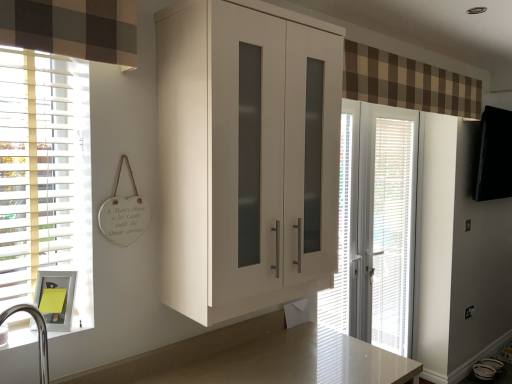
The height and width of the screenshot is (384, 512). Describe the element at coordinates (341, 236) in the screenshot. I see `white textured blind at center, which is the 2th blind from right to left` at that location.

I want to click on white textured blind at center, which is the second blind in back-to-front order, so click(x=341, y=236).

Describe the element at coordinates (56, 298) in the screenshot. I see `white glossy medicine cabinet at lower left` at that location.

What is the approximate height of white glossy medicine cabinet at lower left?

19.23 centimeters.

At what (x,y) coordinates should I click in order to perform the action: click on white glossy cabinet at center. Please return your answer as a coordinate pair (x, y). The height and width of the screenshot is (384, 512). Looking at the image, I should click on (246, 155).

What do you see at coordinates (393, 231) in the screenshot? This screenshot has width=512, height=384. I see `white plastic blinds at right, which appears as the second blind when viewed from the front` at bounding box center [393, 231].

Describe the element at coordinates (375, 227) in the screenshot. I see `white glossy door at center` at that location.

Locate an element on the screen. Image resolution: width=512 pixels, height=384 pixels. brushed metal sink at lower left is located at coordinates (48, 310).

Which object is closer to the camera taking this photo, brushed metal sink at lower left or white glossy medicine cabinet at lower left?

brushed metal sink at lower left.

Does brushed metal sink at lower left have a lesser width compared to white glossy medicine cabinet at lower left?

No, brushed metal sink at lower left is not thinner than white glossy medicine cabinet at lower left.

Based on their positions, is brushed metal sink at lower left located to the left or right of white glossy medicine cabinet at lower left?

Based on their positions, brushed metal sink at lower left is located to the right of white glossy medicine cabinet at lower left.

From the image's perspective, which is below, brushed metal sink at lower left or white glossy medicine cabinet at lower left?

brushed metal sink at lower left.

Consider the image. From the image's perspective, is brown checkered fabric at upper center on white glossy door at center?

Yes.

Considering the sizes of objects brown checkered fabric at upper center and white glossy door at center in the image provided, who is bigger, brown checkered fabric at upper center or white glossy door at center?

brown checkered fabric at upper center.

Can you tell me how much brown checkered fabric at upper center and white glossy door at center differ in facing direction?

They differ by 0.517 degrees in their facing directions.

Based on the photo, who is bigger, brushed metal sink at lower left or white textured blind at center, which is the 2th blind from right to left?

With larger size is white textured blind at center, which is the 2th blind from right to left.

From a real-world perspective, is brushed metal sink at lower left on white textured blind at center, which is the second blind in back-to-front order?

Incorrect, from a real-world perspective, brushed metal sink at lower left is lower than white textured blind at center, which is the second blind in back-to-front order.

Identify the location of the 1st blind behind the brushed metal sink at lower left. This screenshot has height=384, width=512. (341, 236).

Is brushed metal sink at lower left turned away from white textured blind at center, which is the first blind from front to back?

No, brushed metal sink at lower left is not facing away from white textured blind at center, which is the first blind from front to back.

Would you consider white plastic blinds at right, which appears as the second blind when viewed from the front, to be distant from brown checkered fabric at upper center?

No, white plastic blinds at right, which appears as the second blind when viewed from the front, is not far from brown checkered fabric at upper center.

From the image's perspective, who appears lower, white plastic blinds at right, which is the second blind from left to right, or brown checkered fabric at upper center?

white plastic blinds at right, which is the second blind from left to right, is shown below in the image.

Is white plastic blinds at right, acting as the first blind starting from the right, further to camera compared to brown checkered fabric at upper center?

Yes, it is behind brown checkered fabric at upper center.

Which is in front, point (380, 262) or point (385, 75)?

The point (385, 75) is more forward.

At what (x,y) coordinates should I click in order to perform the action: click on medicine cabinet in front of the brown checkered fabric at upper center. Please return your answer as a coordinate pair (x, y). The height and width of the screenshot is (384, 512). Looking at the image, I should click on (56, 298).

Looking at this image, is brown checkered fabric at upper center at the right side of white glossy medicine cabinet at lower left?

Indeed, brown checkered fabric at upper center is positioned on the right side of white glossy medicine cabinet at lower left.

Is brown checkered fabric at upper center looking in the opposite direction of white glossy medicine cabinet at lower left?

No.

Does point (351, 51) come behind point (49, 290)?

That is True.

Locate an element on the screen. medicine cabinet below the white glossy cabinet at center (from the image's perspective) is located at coordinates (56, 298).

Looking at this image, from a real-world perspective, relative to white glossy medicine cabinet at lower left, is white glossy cabinet at center vertically above or below?

white glossy cabinet at center is above white glossy medicine cabinet at lower left.

Between point (330, 191) and point (58, 314), which one is positioned behind?

The point (330, 191) is farther.

Considering the relative positions of white glossy cabinet at center and white glossy medicine cabinet at lower left in the image provided, is white glossy cabinet at center to the left of white glossy medicine cabinet at lower left from the viewer's perspective?

Incorrect, white glossy cabinet at center is not on the left side of white glossy medicine cabinet at lower left.

Measure the distance between brushed metal sink at lower left and white glossy door at center.

brushed metal sink at lower left is 1.96 meters away from white glossy door at center.

In the image, is brushed metal sink at lower left on the left side or the right side of white glossy door at center?

From the image, it's evident that brushed metal sink at lower left is to the left of white glossy door at center.

Does brushed metal sink at lower left have a greater height compared to white glossy door at center?

No, brushed metal sink at lower left is not taller than white glossy door at center.

From the image's perspective, is brushed metal sink at lower left located above or below white glossy door at center?

From the image's perspective, brushed metal sink at lower left appears below white glossy door at center.

I want to click on sink that is on the right side of white glossy medicine cabinet at lower left, so click(x=48, y=310).

What are the coordinates of `curtain above the white glossy door at center (from a real-world perspective)` in the screenshot? It's located at (407, 83).

From the picture: Which object lies nearer to the anchor point white glossy door at center, white glossy medicine cabinet at lower left or white glossy cabinet at center?

white glossy cabinet at center lies closer to white glossy door at center than the other object.

Considering their positions, is white textured blind at center, which is the second blind in back-to-front order, positioned further to brushed metal sink at lower left than white plastic blinds at right, acting as the first blind starting from the right?

Among the two, white plastic blinds at right, acting as the first blind starting from the right, is located further to brushed metal sink at lower left.

In the scene shown: From the image, which object appears to be nearer to brushed metal sink at lower left, brown checkered fabric at upper center or white glossy medicine cabinet at lower left?

The object closer to brushed metal sink at lower left is white glossy medicine cabinet at lower left.

When comparing their distances from white glossy door at center, does white plastic blinds at right, which appears as the second blind when viewed from the front, or white glossy cabinet at center seem further?

Based on the image, white glossy cabinet at center appears to be further to white glossy door at center.

Based on their spatial positions, is brown checkered fabric at upper center or white glossy door at center closer to white glossy cabinet at center?

Based on the image, brown checkered fabric at upper center appears to be nearer to white glossy cabinet at center.

When comparing their distances from white plastic blinds at right, which is the second blind from left to right, does white glossy door at center or white glossy cabinet at center seem further?

white glossy cabinet at center is further to white plastic blinds at right, which is the second blind from left to right.

Looking at the image, which one is located closer to white plastic blinds at right, which ranks as the first blind in back-to-front order, brown checkered fabric at upper center or white glossy medicine cabinet at lower left?

brown checkered fabric at upper center.

Based on their spatial positions, is brushed metal sink at lower left or white glossy cabinet at center closer to white textured blind at center, which is the second blind in back-to-front order?

white glossy cabinet at center.

In order to click on sink situated between white glossy medicine cabinet at lower left and brown checkered fabric at upper center from left to right in this screenshot , I will do `click(48, 310)`.

Image resolution: width=512 pixels, height=384 pixels. I want to click on medicine cabinet between brushed metal sink at lower left and white plastic blinds at right, which ranks as the first blind in back-to-front order, from front to back, so click(56, 298).

You are a GUI agent. You are given a task and a screenshot of the screen. Output one action in this format:
    pyautogui.click(x=<x>, y=<y>)
    Task: Click on the cabinetry between white glossy medicine cabinet at lower left and brown checkered fabric at upper center in the horizontal direction
    The width and height of the screenshot is (512, 384).
    Given the screenshot: What is the action you would take?
    pyautogui.click(x=246, y=155)

Locate an element on the screen. blind situated between white glossy medicine cabinet at lower left and white glossy door at center from left to right is located at coordinates (341, 236).